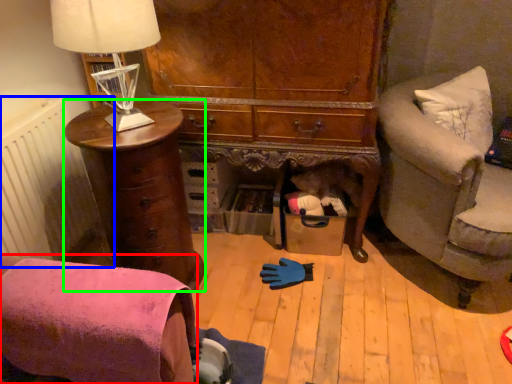
Question: Which is nearer to the chair (highlighted by a red box)? radiator (highlighted by a blue box) or chest of drawers (highlighted by a green box).

Choices:
 (A) radiator
 (B) chest of drawers

Answer: (B)